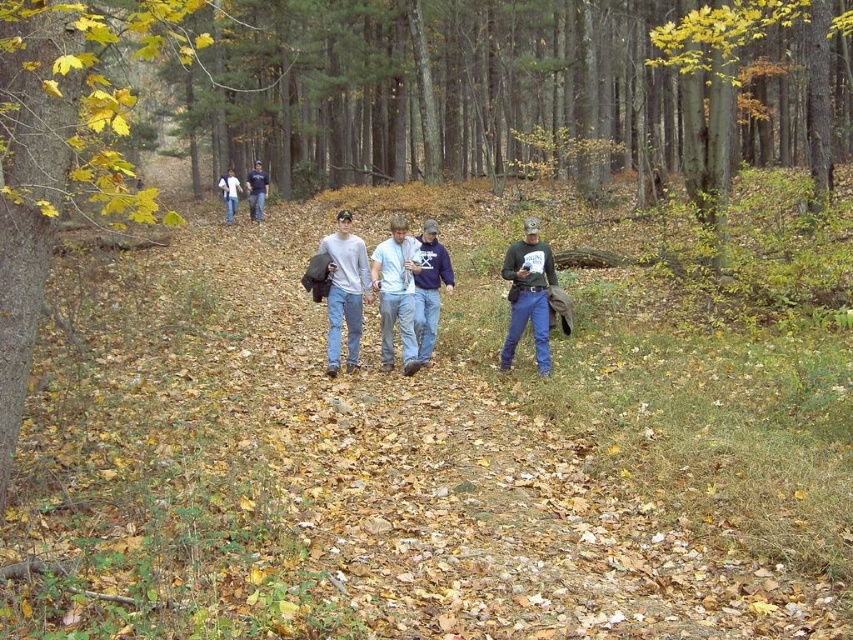
Question: Is blue cotton shirt at center below white cotton shirt at upper center?

Choices:
 (A) yes
 (B) no

Answer: (A)

Question: Which point is farther from the camera taking this photo?

Choices:
 (A) (437, 321)
 (B) (254, 218)
 (C) (15, 413)

Answer: (B)

Question: Among these points, which one is nearest to the camera?

Choices:
 (A) tap(341, 228)
 (B) tap(426, 259)

Answer: (A)

Question: Is matte green shirt at center positioned at the back of light gray cotton shirt at center?

Choices:
 (A) yes
 (B) no

Answer: (B)

Question: Which point is farther to the camera?

Choices:
 (A) (413, 323)
 (B) (373, 282)
 (C) (515, 256)
 (D) (253, 179)

Answer: (D)

Question: Does light gray cotton shirt at center have a lesser width compared to white cotton shirt at upper center?

Choices:
 (A) no
 (B) yes

Answer: (B)